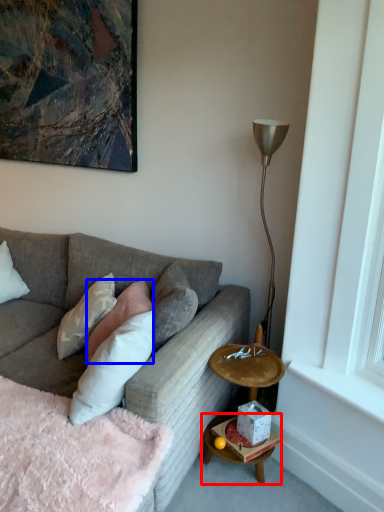
Question: Among these objects, which one is farthest to the camera, table (highlighted by a red box) or pillow (highlighted by a blue box)?

Choices:
 (A) table
 (B) pillow

Answer: (B)